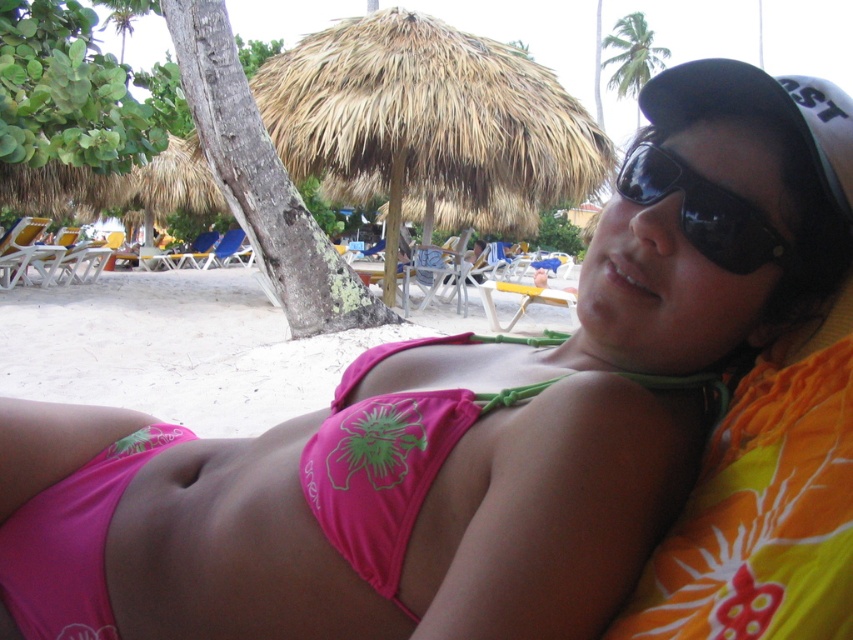
You are a photographer trying to capture the pink fabric bikini top at center. You notice a point at coordinates (392, 458). Is this point located on the bikini top?

Yes, the point at coordinates (392, 458) is located on the pink fabric bikini top at center.

You are standing at point (746,253) and want to walk to point (461,408). Which direction should you move in relative to the beach scene?

You should move forward because point (461,408) is behind point (746,253), so moving forward from your current position will take you towards it.